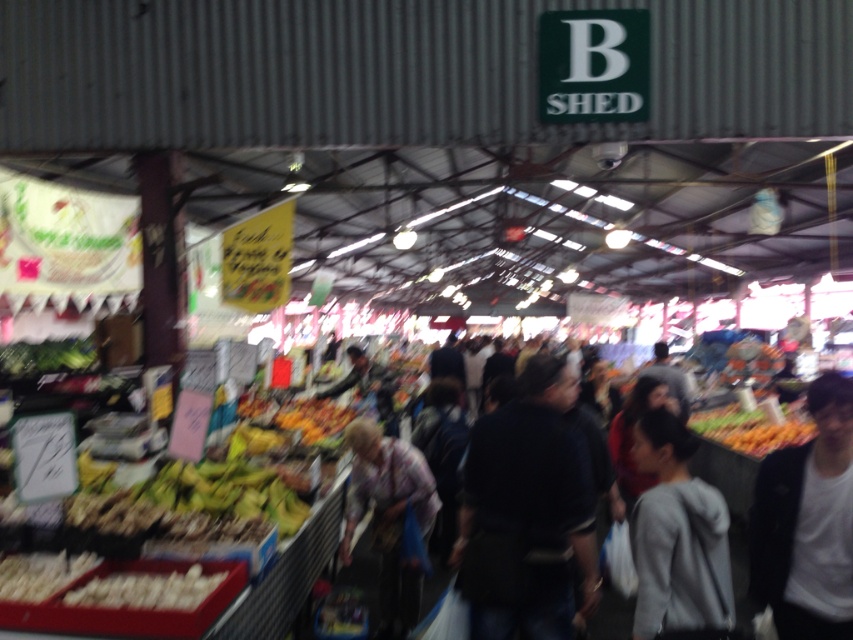
You are a customer in the market and want to buy a jacket. You notice the white matte jacket at lower right and the dark gray hoodie at center. Which one is narrower in width?

The white matte jacket at lower right has a lesser width compared to the dark gray hoodie at center, so the white matte jacket at lower right is narrower.